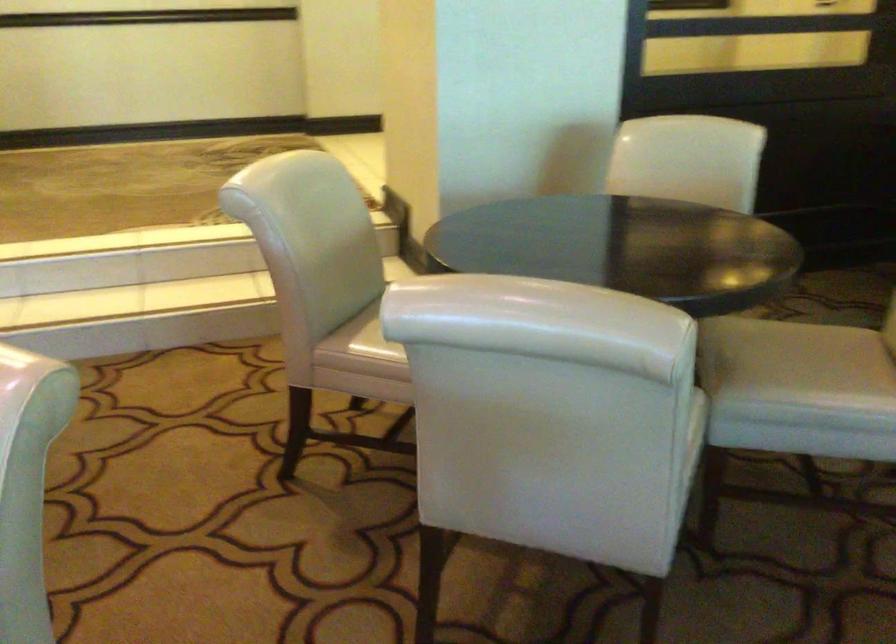
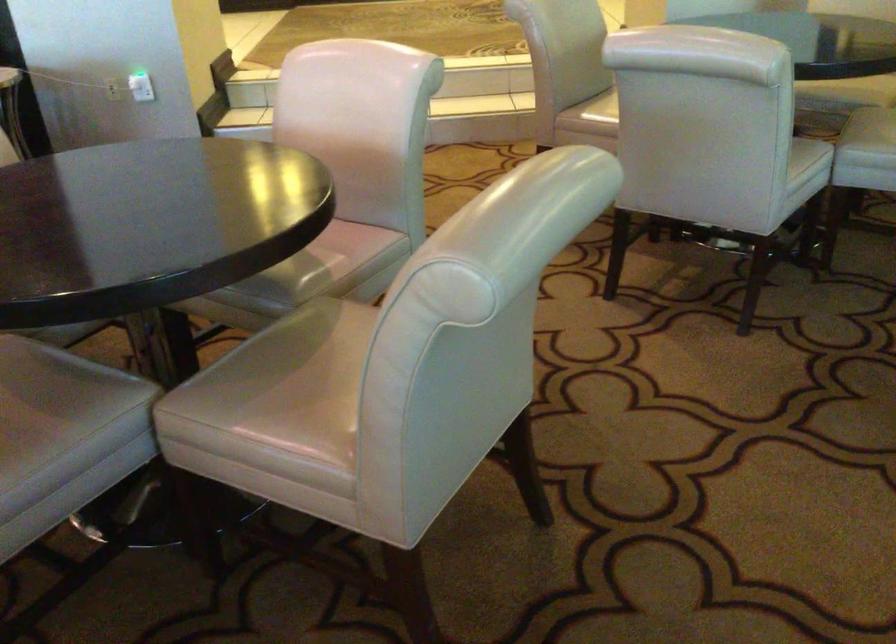
Find the pixel in the second image that matches [739,370] in the first image.

(874, 125)